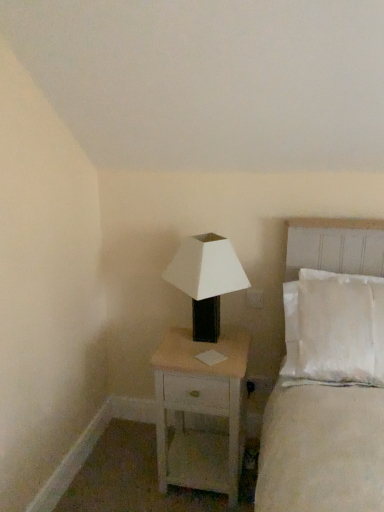
Question: Is white wood nightstand at center at the left side of white matte/black textured lamp at center?

Choices:
 (A) no
 (B) yes

Answer: (A)

Question: Is white wood nightstand at center completely or partially outside of white matte/black textured lamp at center?

Choices:
 (A) yes
 (B) no

Answer: (A)

Question: Considering the relative sizes of white wood nightstand at center and white matte/black textured lamp at center in the image provided, is white wood nightstand at center bigger than white matte/black textured lamp at center?

Choices:
 (A) yes
 (B) no

Answer: (A)

Question: From a real-world perspective, is white wood nightstand at center located beneath white matte/black textured lamp at center?

Choices:
 (A) no
 (B) yes

Answer: (B)

Question: Can you confirm if white wood nightstand at center is shorter than white matte/black textured lamp at center?

Choices:
 (A) no
 (B) yes

Answer: (A)

Question: Considering the relative sizes of white wood nightstand at center and white matte/black textured lamp at center in the image provided, is white wood nightstand at center wider than white matte/black textured lamp at center?

Choices:
 (A) yes
 (B) no

Answer: (A)

Question: Could you tell me if white cotton bed at right is facing white wood nightstand at center?

Choices:
 (A) yes
 (B) no

Answer: (B)

Question: From the image's perspective, is white cotton bed at right over white wood nightstand at center?

Choices:
 (A) yes
 (B) no

Answer: (A)

Question: Is white cotton bed at right smaller than white wood nightstand at center?

Choices:
 (A) yes
 (B) no

Answer: (B)

Question: Considering the relative sizes of white cotton bed at right and white wood nightstand at center in the image provided, is white cotton bed at right bigger than white wood nightstand at center?

Choices:
 (A) no
 (B) yes

Answer: (B)

Question: Is white wood nightstand at center completely or partially inside white cotton bed at right?

Choices:
 (A) yes
 (B) no

Answer: (B)

Question: Does white cotton bed at right come in front of white wood nightstand at center?

Choices:
 (A) yes
 (B) no

Answer: (A)

Question: Is white matte/black textured lamp at center positioned before white cotton bed at right?

Choices:
 (A) yes
 (B) no

Answer: (B)